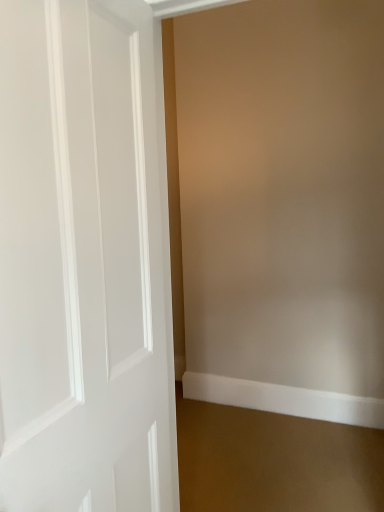
Question: Can you confirm if white glossy door at left is smaller than white smooth baseboard at lower right?

Choices:
 (A) yes
 (B) no

Answer: (B)

Question: Is white glossy door at left not near white smooth baseboard at lower right?

Choices:
 (A) yes
 (B) no

Answer: (A)

Question: Is white glossy door at left at the left side of white smooth baseboard at lower right?

Choices:
 (A) no
 (B) yes

Answer: (B)

Question: Can you confirm if white glossy door at left is wider than white smooth baseboard at lower right?

Choices:
 (A) yes
 (B) no

Answer: (A)

Question: Considering the relative positions of white glossy door at left and white smooth baseboard at lower right in the image provided, is white glossy door at left behind white smooth baseboard at lower right?

Choices:
 (A) yes
 (B) no

Answer: (B)

Question: Is white glossy door at left in front of white smooth baseboard at lower right?

Choices:
 (A) yes
 (B) no

Answer: (A)

Question: Is white smooth baseboard at lower right thinner than white glossy door at left?

Choices:
 (A) yes
 (B) no

Answer: (A)

Question: Is white smooth baseboard at lower right not inside white glossy door at left?

Choices:
 (A) no
 (B) yes

Answer: (B)

Question: Is white smooth baseboard at lower right to the right of white glossy door at left from the viewer's perspective?

Choices:
 (A) no
 (B) yes

Answer: (B)

Question: Is white smooth baseboard at lower right taller than white glossy door at left?

Choices:
 (A) yes
 (B) no

Answer: (B)

Question: Does white smooth baseboard at lower right appear on the left side of white glossy door at left?

Choices:
 (A) no
 (B) yes

Answer: (A)

Question: From a real-world perspective, is white smooth baseboard at lower right physically below white glossy door at left?

Choices:
 (A) yes
 (B) no

Answer: (A)

Question: From their relative heights in the image, would you say white smooth baseboard at lower right is taller or shorter than white glossy door at left?

Choices:
 (A) short
 (B) tall

Answer: (A)